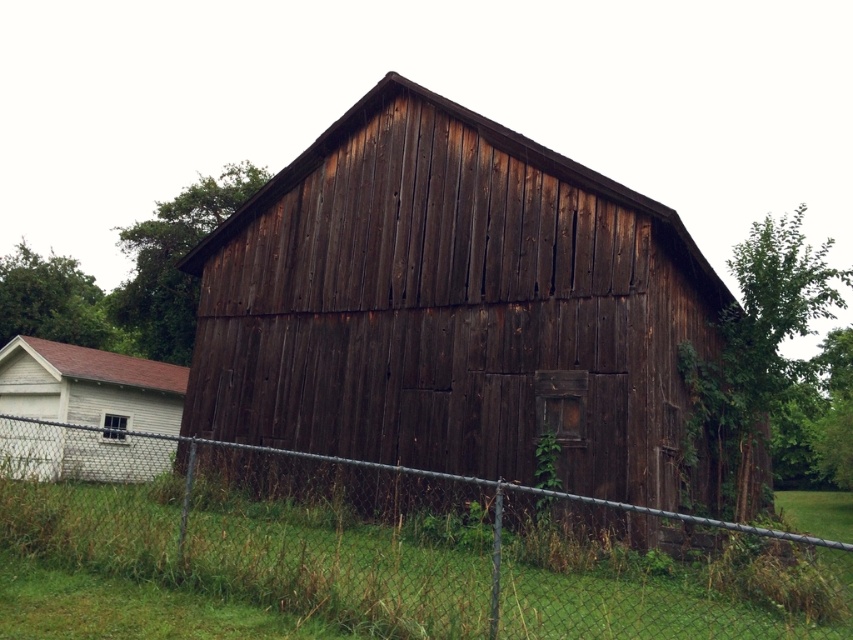
Can you confirm if dark wood barn at center is positioned to the right of green grass at lower center?

Correct, you'll find dark wood barn at center to the right of green grass at lower center.

The width and height of the screenshot is (853, 640). Identify the location of dark wood barn at center. (453, 307).

Between point (392, 176) and point (242, 548), which one is positioned in front?

Positioned in front is point (242, 548).

Locate an element on the screen. Image resolution: width=853 pixels, height=640 pixels. dark wood barn at center is located at coordinates (453, 307).